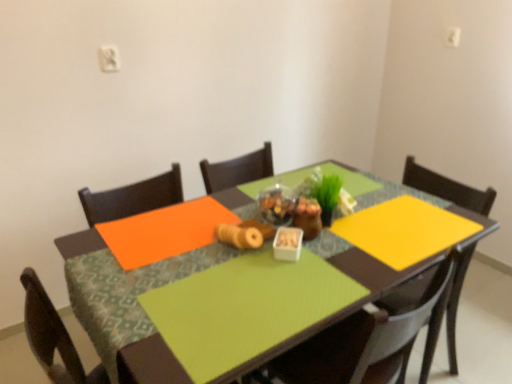
Where is `vacant area that is in front of white matte container at center`? This screenshot has width=512, height=384. vacant area that is in front of white matte container at center is located at coordinates (292, 288).